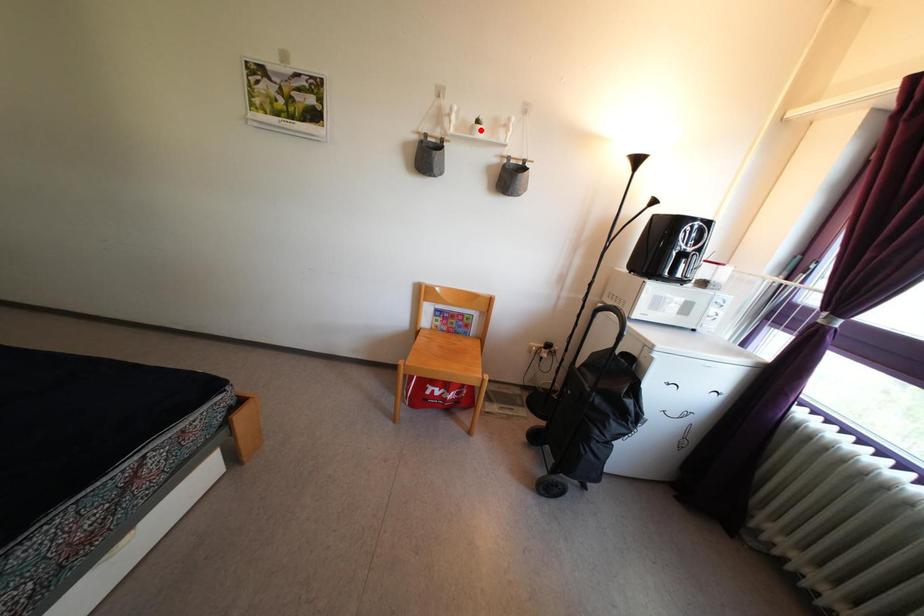
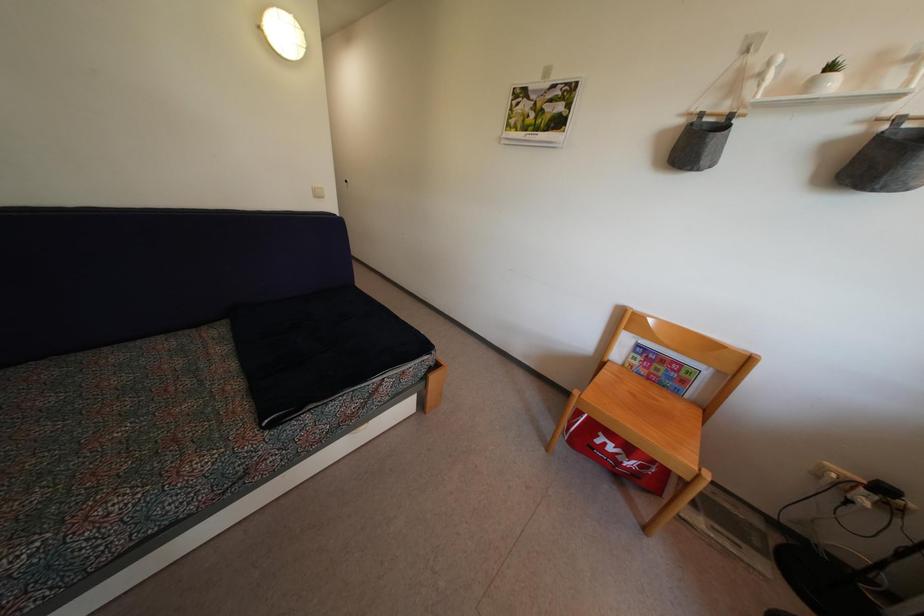
The point at the highlighted location is marked in the first image. Where is the corresponding point in the second image?

(833, 76)